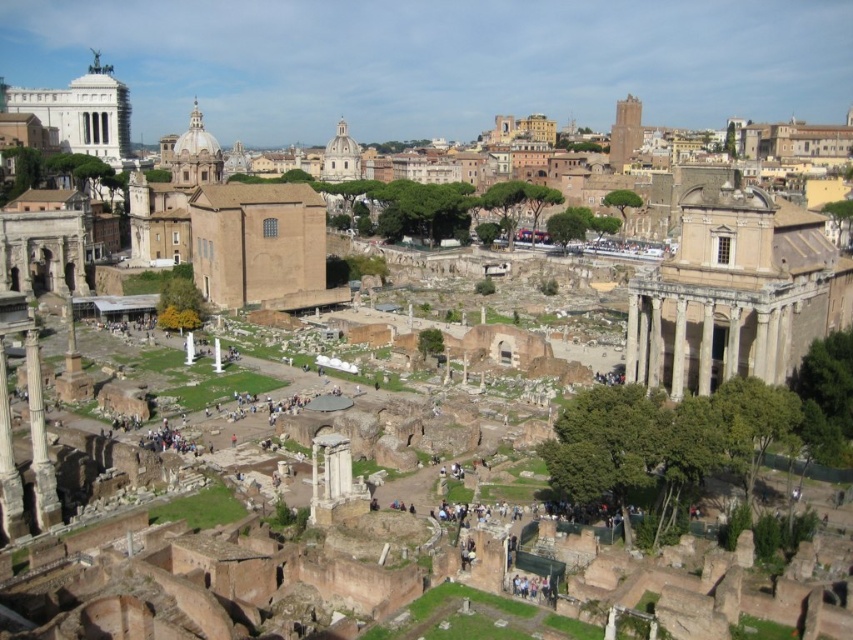
Question: Which point is closer to the camera?

Choices:
 (A) (753, 196)
 (B) (33, 490)

Answer: (B)

Question: Where is beige stone temple at center right located in relation to white marble column at left in the image?

Choices:
 (A) left
 (B) right

Answer: (B)

Question: Can you confirm if beige stone temple at center right is positioned to the right of white marble column at left?

Choices:
 (A) no
 (B) yes

Answer: (B)

Question: Which point is farther to the camera?

Choices:
 (A) (737, 365)
 (B) (36, 394)

Answer: (A)

Question: Is beige stone temple at center right to the right of white marble column at left from the viewer's perspective?

Choices:
 (A) no
 (B) yes

Answer: (B)

Question: Which point is closer to the camera taking this photo?

Choices:
 (A) (28, 417)
 (B) (734, 355)

Answer: (A)